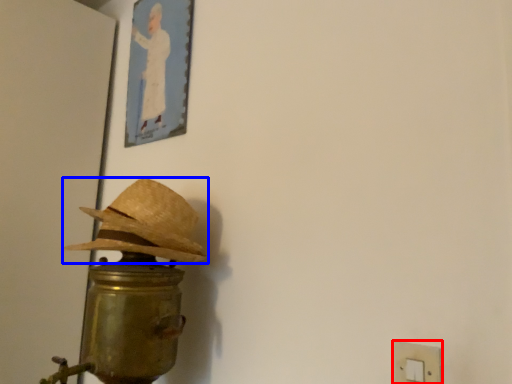
Question: Among these objects, which one is nearest to the camera, light switch (highlighted by a red box) or hat (highlighted by a blue box)?

Choices:
 (A) light switch
 (B) hat

Answer: (A)